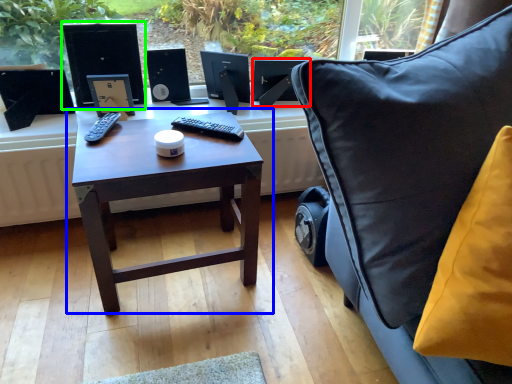
Question: Which object is the farthest from computer monitor (highlighted by a red box)? Choose among these: table (highlighted by a blue box) or desktop computer (highlighted by a green box).

Choices:
 (A) table
 (B) desktop computer

Answer: (A)